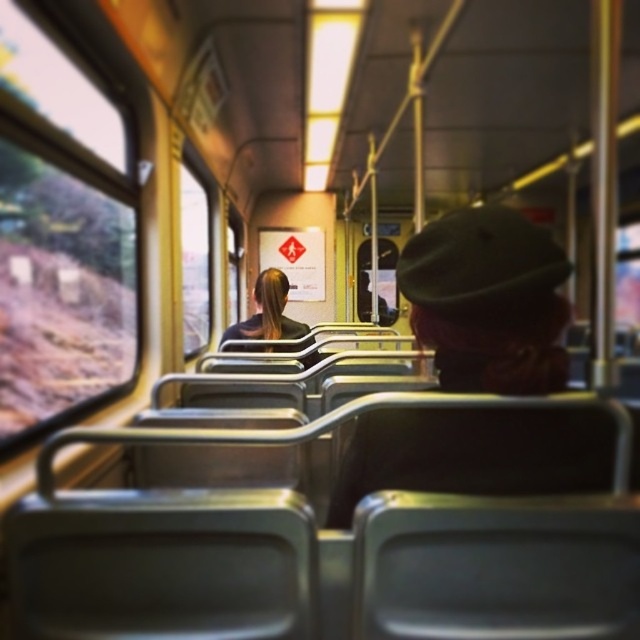
You are a passenger on a train and need to check the outside view through the transparent glass window at center while also looking at your reflection in the black fabric hair at center. Which object should you look to your left to see?

The transparent glass window at center is to the left of the black fabric hair at center, so you should look to your left to see the transparent glass window at center.

You are a passenger on a train and want to see outside through the transparent glass window at center. Is the black fabric hair at center blocking your view of the window?

The black fabric hair at center is behind the transparent glass window at center, so it is not blocking your view of the window.